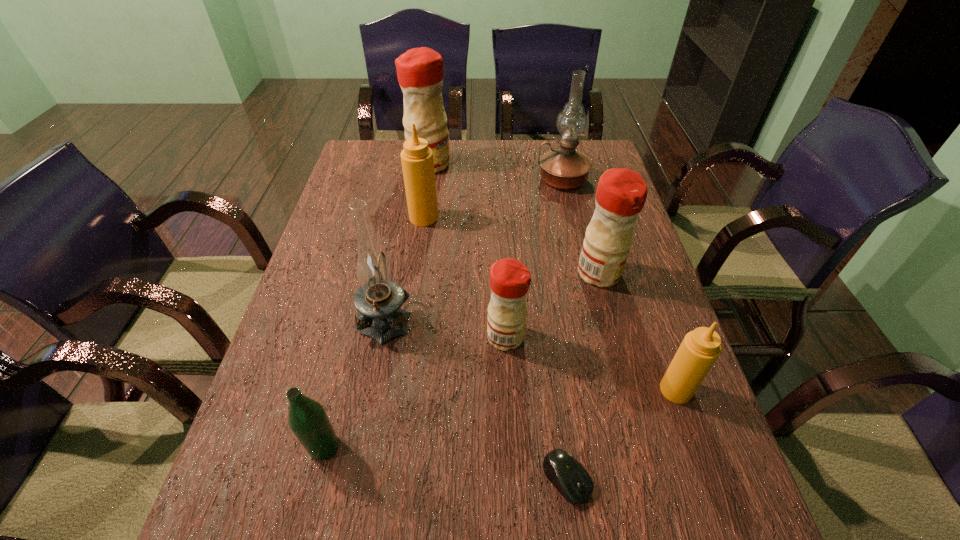
Identify which object is the sixth nearest to the biggest red condiment. Please provide its 2D coordinates. Your answer should be formatted as a tuple, i.e. [(x, y)], where the tuple contains the x and y coordinates of a point satisfying the conditions above.

[(307, 418)]

Identify the location of condiment that is the third closest to the black mouse. (621, 193).

Locate which condiment ranks third in proximity to the farthest condiment. Please provide its 2D coordinates. Your answer should be formatted as a tuple, i.e. [(x, y)], where the tuple contains the x and y coordinates of a point satisfying the conditions above.

[(510, 279)]

Choose which red condiment is the third nearest neighbor to the bottle. Please provide its 2D coordinates. Your answer should be formatted as a tuple, i.e. [(x, y)], where the tuple contains the x and y coordinates of a point satisfying the conditions above.

[(419, 70)]

Select which red condiment appears as the third closest to the black mouse. Please provide its 2D coordinates. Your answer should be formatted as a tuple, i.e. [(x, y)], where the tuple contains the x and y coordinates of a point satisfying the conditions above.

[(419, 70)]

Find the location of `free spot that satisfies the following two spatial constraints: 1. on the front side of the third condiment from right to left; 2. on the right side of the nearer oil lamp`. free spot that satisfies the following two spatial constraints: 1. on the front side of the third condiment from right to left; 2. on the right side of the nearer oil lamp is located at coordinates (383, 337).